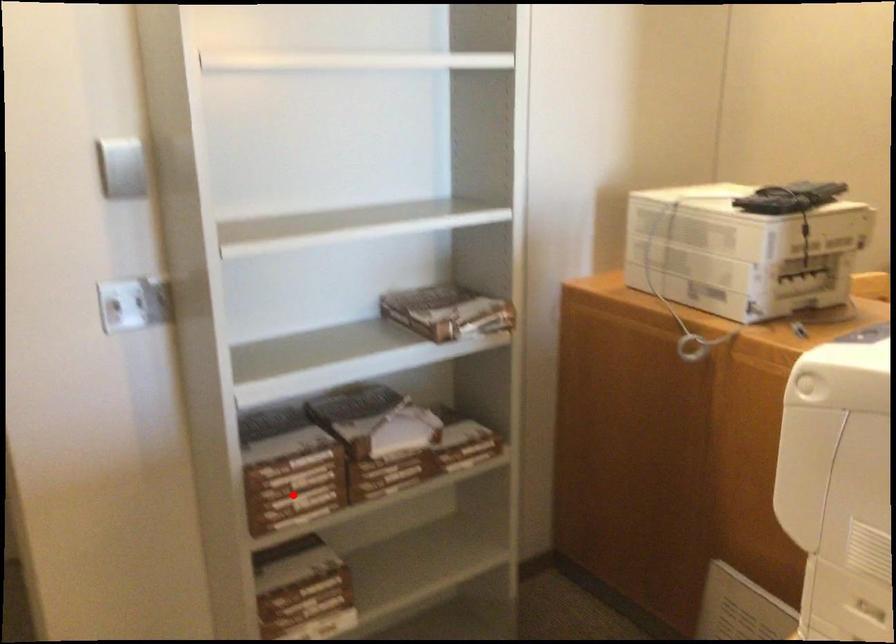
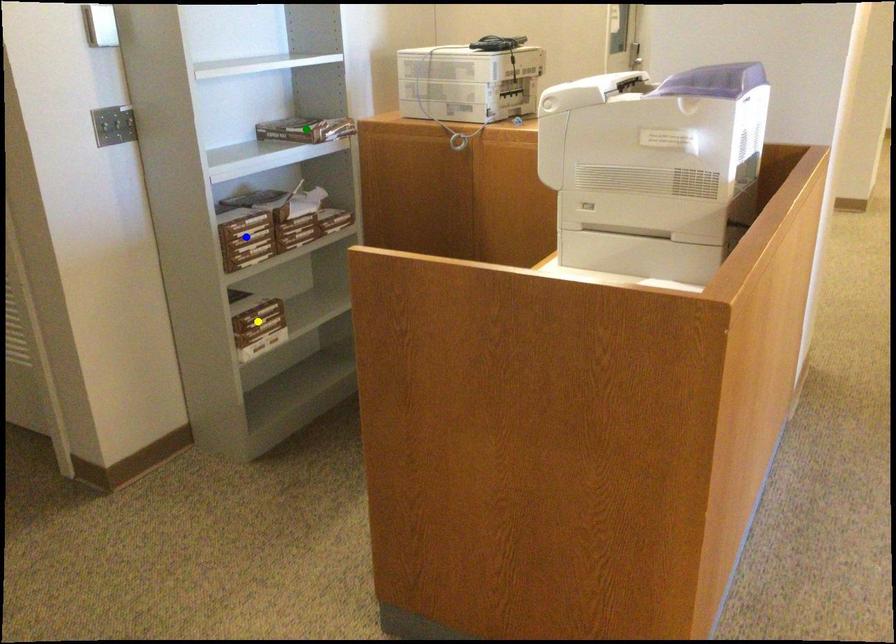
Question: I am providing you with two images of the same scene from different viewpoints. A red point is marked on the first image. You are given multiple points on the second image. Can you choose the point in image 2 that corresponds to the point in image 1?

Choices:
 (A) green point
 (B) yellow point
 (C) blue point

Answer: (C)